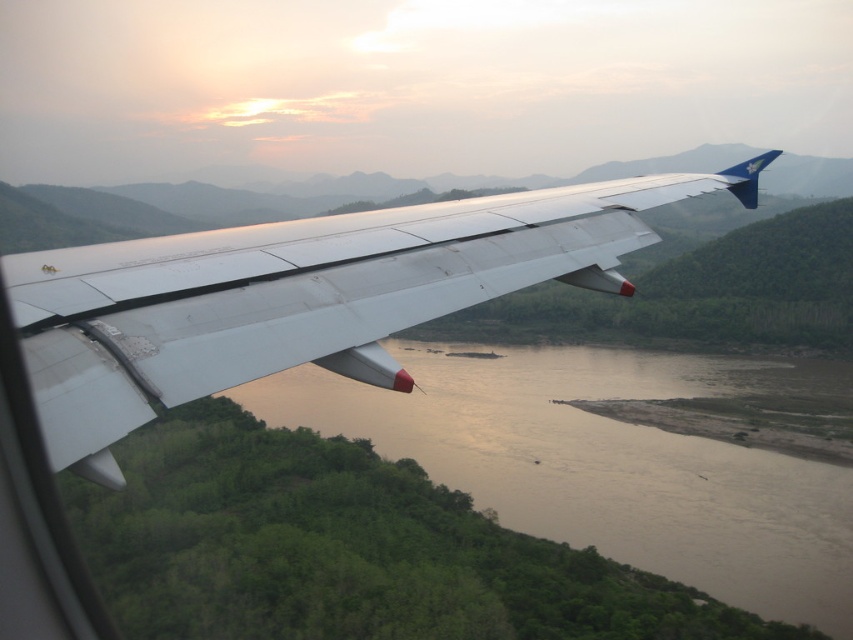
You are a passenger looking out the window of the aircraft. You notice the white metallic wing at center and the brown muddy water at center. Which object is closer to you?

The white metallic wing at center is closer to you because it is positioned above the brown muddy water at center, meaning it is between you and the water.

Consider the image. You are a passenger looking out the window of the aircraft. You see two points marked on the wing. The first point is at coordinates point (440, 298) and the second is at point (322, 420). From your perspective inside the plane, which point is closer to the front of the aircraft?

Point (440, 298) is in front of point (322, 420), so the first point is closer to the front of the aircraft.